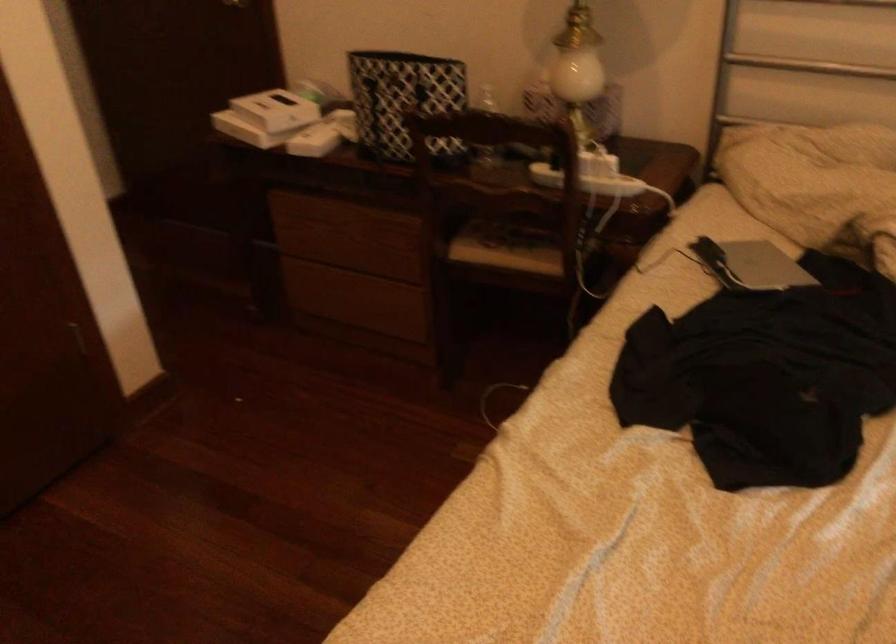
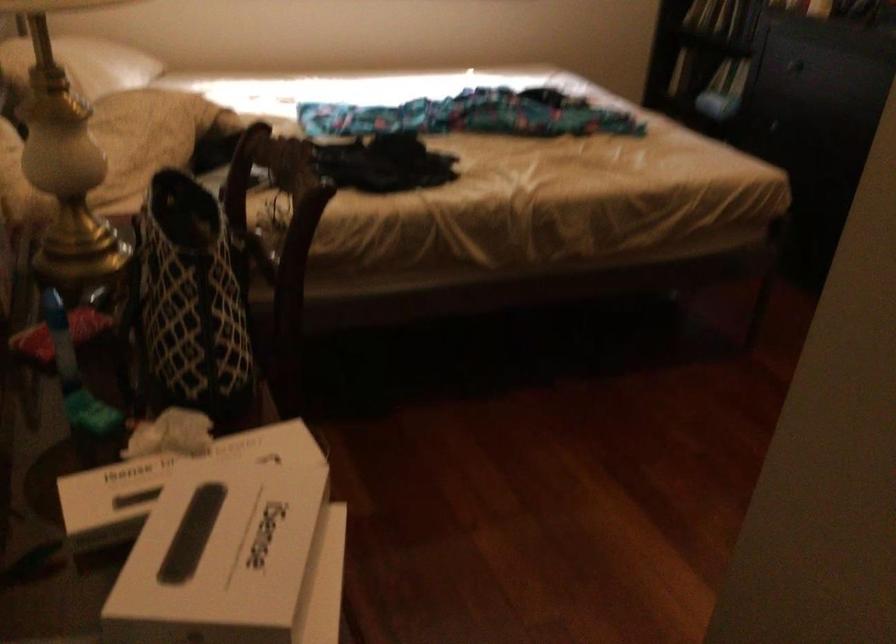
The point at (x=311, y=100) is marked in the first image. Where is the corresponding point in the second image?

(168, 477)